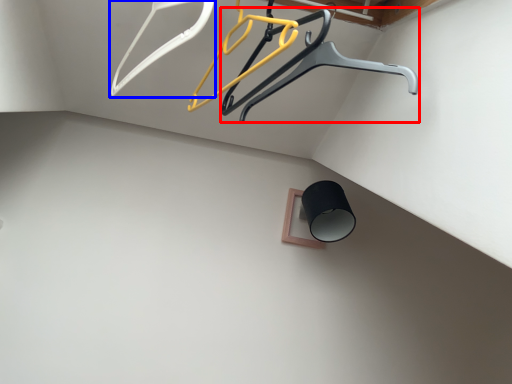
Question: Among these objects, which one is nearest to the camera, furniture (highlighted by a red box) or hanger (highlighted by a blue box)?

Choices:
 (A) furniture
 (B) hanger

Answer: (B)